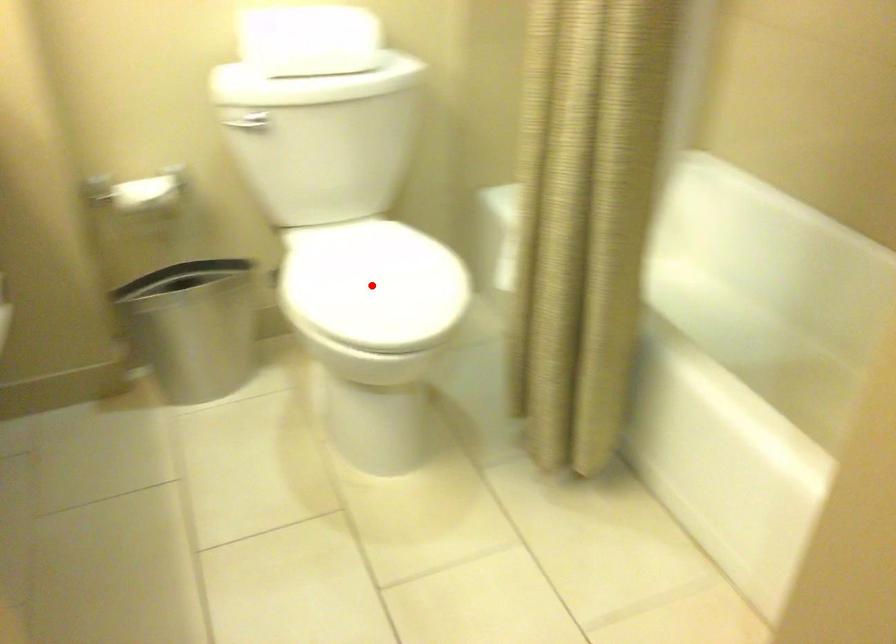
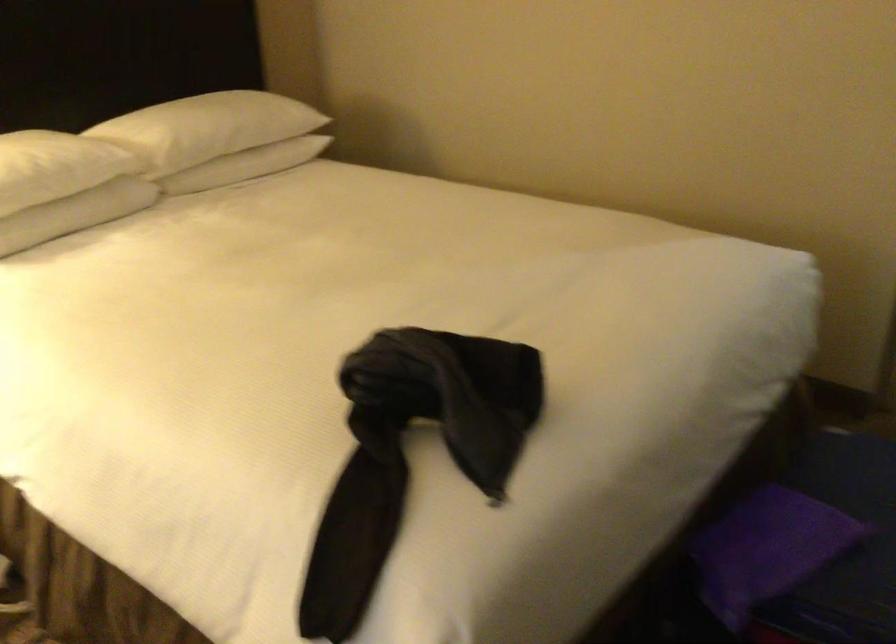
Question: I am providing you with two images of the same scene from different viewpoints. A red point is marked on the first image. Is the red point's position out of view in image 2?

Choices:
 (A) Yes
 (B) No

Answer: (A)